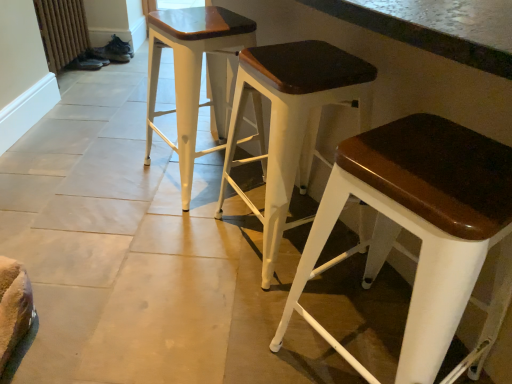
Question: Is matte white stool at center, which is the second stool from left to right, surrounding white wood stool at center, the 3th stool in the left-to-right sequence?

Choices:
 (A) yes
 (B) no

Answer: (B)

Question: Is matte white stool at center, which is the second stool from left to right, far away from white wood stool at center, the first stool viewed from the right?

Choices:
 (A) no
 (B) yes

Answer: (A)

Question: From the image's perspective, is matte white stool at center, which is the second stool from left to right, under white wood stool at center, the first stool viewed from the right?

Choices:
 (A) yes
 (B) no

Answer: (B)

Question: Considering the relative sizes of matte white stool at center, acting as the 2th stool starting from the right, and white wood stool at center, the 3th stool in the left-to-right sequence, in the image provided, is matte white stool at center, acting as the 2th stool starting from the right, wider than white wood stool at center, the 3th stool in the left-to-right sequence,?

Choices:
 (A) yes
 (B) no

Answer: (B)

Question: Would you say matte white stool at center, acting as the 2th stool starting from the right, is outside white wood stool at center, the 3th stool in the left-to-right sequence?

Choices:
 (A) no
 (B) yes

Answer: (B)

Question: In terms of size, does rustic wood radiator at lower left appear bigger or smaller than white wood stool at center, the first stool when ordered from left to right?

Choices:
 (A) big
 (B) small

Answer: (B)

Question: From a real-world perspective, relative to white wood stool at center, the 3th stool in the right-to-left sequence, is rustic wood radiator at lower left vertically above or below?

Choices:
 (A) above
 (B) below

Answer: (B)

Question: Looking at their shapes, would you say rustic wood radiator at lower left is wider or thinner than white wood stool at center, the 3th stool in the right-to-left sequence?

Choices:
 (A) wide
 (B) thin

Answer: (B)

Question: Which is correct: rustic wood radiator at lower left is inside white wood stool at center, the first stool when ordered from left to right, or outside of it?

Choices:
 (A) outside
 (B) inside

Answer: (A)

Question: Considering the positions of white wood stool at center, the 3th stool in the left-to-right sequence, and rustic wood radiator at lower left in the image, is white wood stool at center, the 3th stool in the left-to-right sequence, taller or shorter than rustic wood radiator at lower left?

Choices:
 (A) tall
 (B) short

Answer: (A)

Question: Is white wood stool at center, the 3th stool in the left-to-right sequence, situated inside rustic wood radiator at lower left or outside?

Choices:
 (A) inside
 (B) outside

Answer: (B)

Question: Considering the positions of white wood stool at center, the first stool viewed from the right, and rustic wood radiator at lower left in the image, is white wood stool at center, the first stool viewed from the right, bigger or smaller than rustic wood radiator at lower left?

Choices:
 (A) small
 (B) big

Answer: (B)

Question: In the image, is white wood stool at center, the 3th stool in the left-to-right sequence, on the left side or the right side of rustic wood radiator at lower left?

Choices:
 (A) left
 (B) right

Answer: (B)

Question: In terms of size, does white wood stool at center, the 3th stool in the right-to-left sequence, appear bigger or smaller than rustic wood radiator at lower left?

Choices:
 (A) small
 (B) big

Answer: (B)

Question: From the image's perspective, relative to rustic wood radiator at lower left, is white wood stool at center, the first stool when ordered from left to right, above or below?

Choices:
 (A) below
 (B) above

Answer: (A)